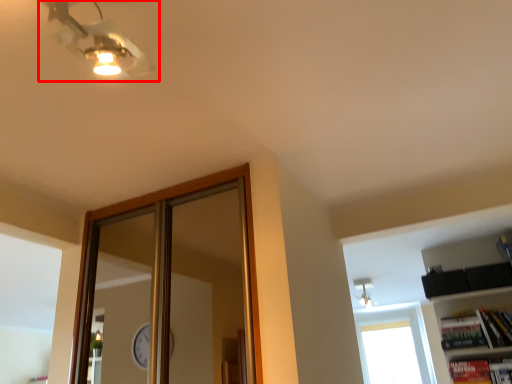
Question: From the image's perspective, what is the correct spatial relationship of fan (annotated by the red box) in relation to window?

Choices:
 (A) below
 (B) above

Answer: (B)